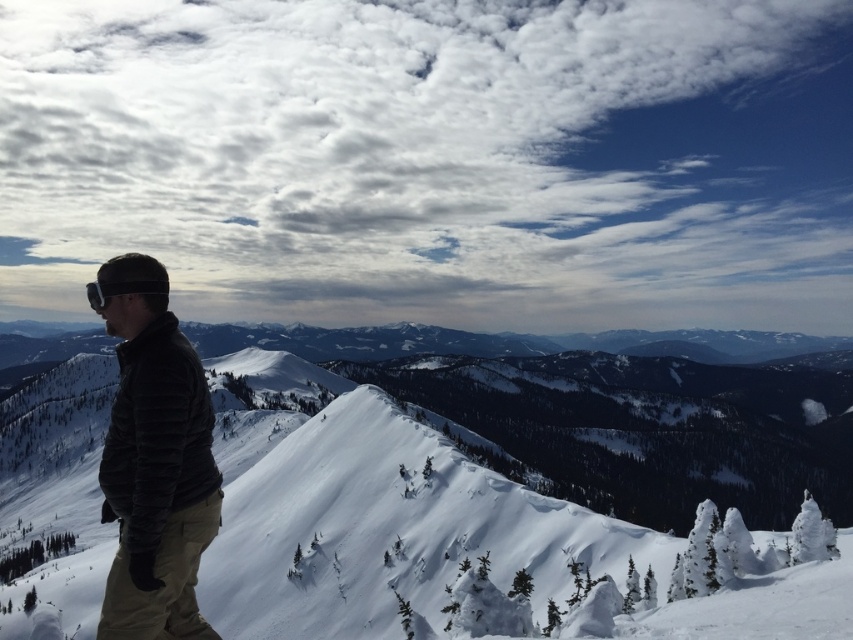
Question: Among these objects, which one is farthest from the camera?

Choices:
 (A) matte black goggles at left
 (B) white fluffy snow at center
 (C) dark gray quilted jacket at left

Answer: (B)

Question: Does dark gray quilted jacket at left appear under matte black goggles at left?

Choices:
 (A) no
 (B) yes

Answer: (B)

Question: Can you confirm if white fluffy snow at center is wider than dark gray quilted jacket at left?

Choices:
 (A) no
 (B) yes

Answer: (B)

Question: Which of the following is the closest to the observer?

Choices:
 (A) (152, 285)
 (B) (544, 444)

Answer: (A)

Question: Does dark gray quilted jacket at left have a greater width compared to matte black goggles at left?

Choices:
 (A) no
 (B) yes

Answer: (A)

Question: Which point is farther from the camera taking this photo?

Choices:
 (A) (625, 419)
 (B) (144, 284)
 (C) (190, 605)

Answer: (A)